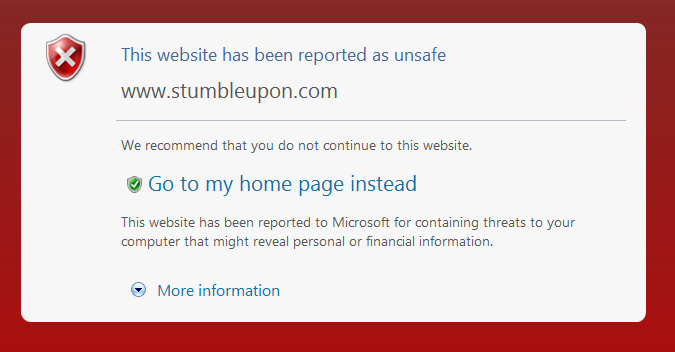
The width and height of the screenshot is (675, 352). Find the location of `curved interior corners`. curved interior corners is located at coordinates point(641,319), point(640,27), point(26,30), point(30,310).